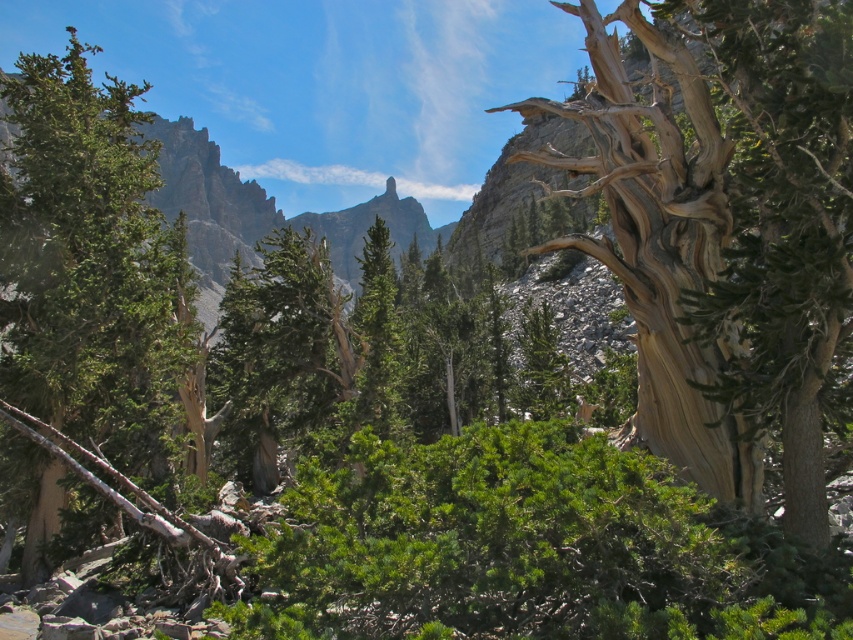
You are a hiker trying to reach the summit of the mountain. You notice a green rough bark tree at left and a green rock at upper center. Which of these two landmarks is taller?

The green rough bark tree at left is not as tall as the green rock at upper center, so the green rock at upper center is taller.